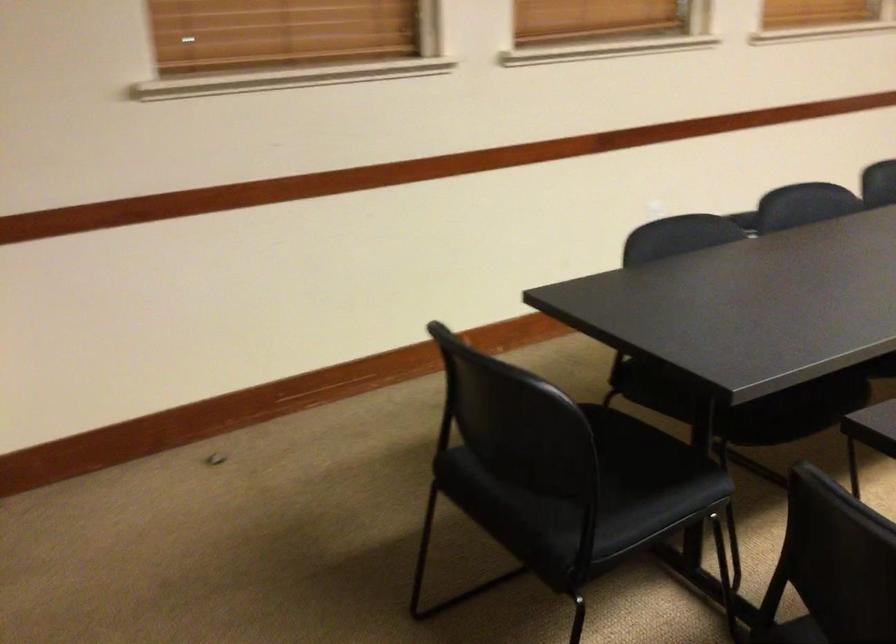
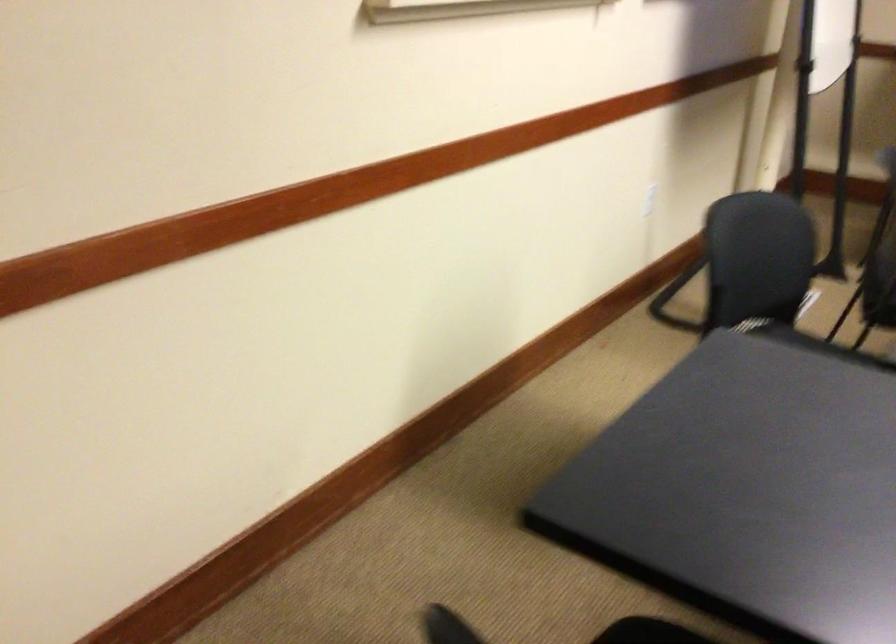
In the scene shown: Based on the continuous images, in which direction is the camera rotating?

The rotation direction of the camera is right-down.